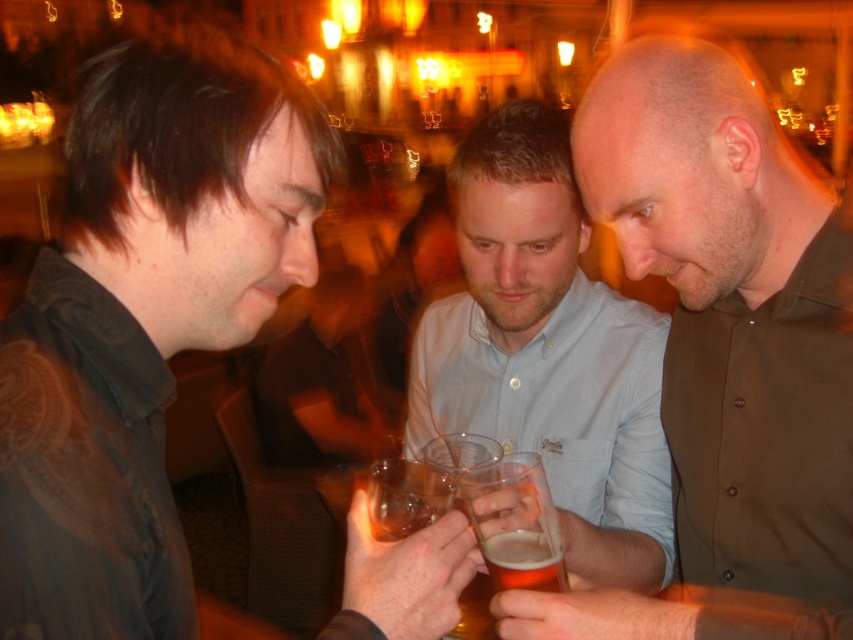
You are standing at the entrance of the bar and want to join the group at the smooth wooden table at center. Which direction should you walk to reach the table?

Since the smooth wooden table at center is located at point coordinates of [318,385], you should walk towards the center of the room to reach the table.